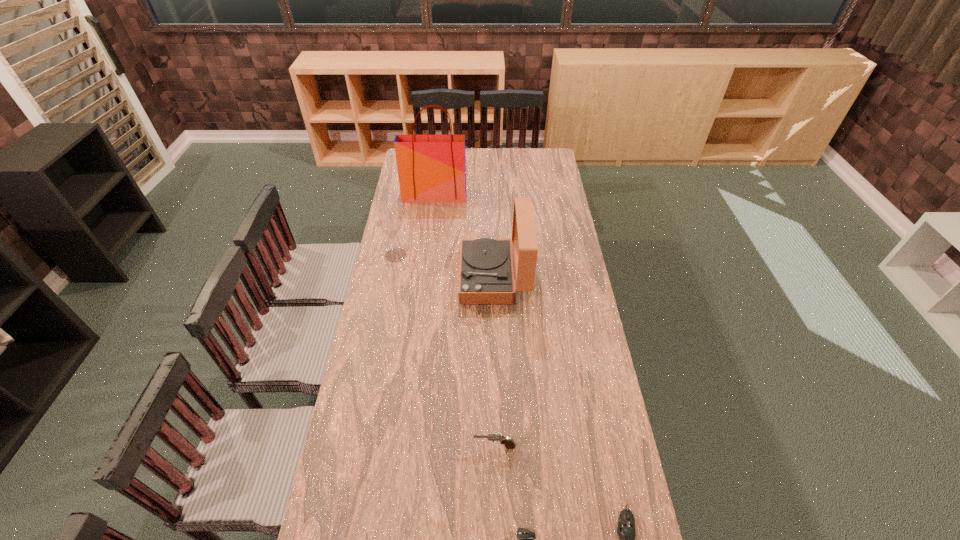
Identify the location of vacant space situated on the front of the flute glass. (388, 298).

Identify the location of free region located at the barrel of the pistol. (442, 447).

Where is `vacant position located at the barrel of the pistol`? vacant position located at the barrel of the pistol is located at coordinates (383, 447).

Locate an element on the screen. Image resolution: width=960 pixels, height=540 pixels. free point located 0.060m at the barrel of the pistol is located at coordinates (454, 447).

Where is `shopping bag located at the left edge`? This screenshot has width=960, height=540. shopping bag located at the left edge is located at coordinates (431, 168).

Locate an element on the screen. The width and height of the screenshot is (960, 540). flute glass at the left edge is located at coordinates (390, 224).

In the image, there is a desktop. Where is `vacant space at the left edge`? This screenshot has height=540, width=960. vacant space at the left edge is located at coordinates (392, 415).

In the image, there is a desktop. Identify the location of vacant space at the right edge. The image size is (960, 540). (565, 242).

You are a GUI agent. You are given a task and a screenshot of the screen. Output one action in this format:
    pyautogui.click(x=<x>, y=<y>)
    Task: Click on the unoccupied position between the tallest object and the fifth shortest object
    
    Given the screenshot: What is the action you would take?
    pyautogui.click(x=465, y=237)

The image size is (960, 540). I want to click on free space that is in between the third shortest object and the farthest object, so click(465, 321).